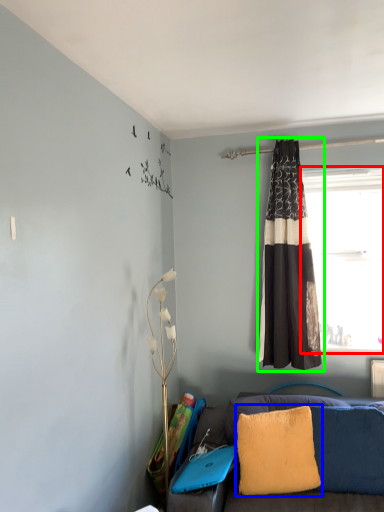
Question: Estimate the real-world distances between objects in this image. Which object is closer to window (highlighted by a red box), pillow (highlighted by a blue box) or curtain (highlighted by a green box)?

Choices:
 (A) pillow
 (B) curtain

Answer: (B)